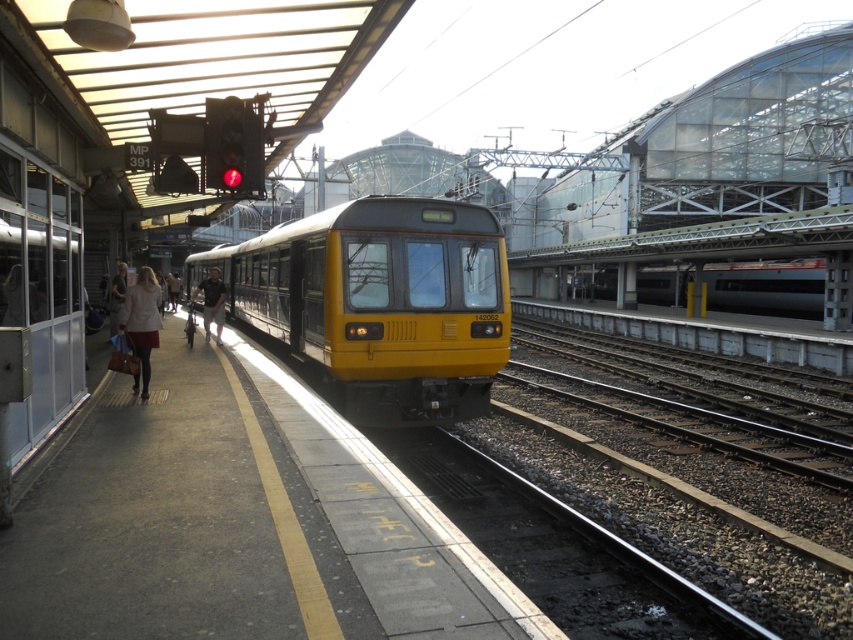
You are a photographer standing on the platform and want to capture both the yellow matte train at center and the matte beige jacket at left in the same frame. Considering their sizes, which object should you focus on to ensure both are clearly visible in the photo?

The yellow matte train at center is larger in size than the matte beige jacket at left, so focusing on the yellow matte train at center would ensure both are clearly visible in the photo.

You are standing on the platform and want to take a photo of the yellow matte train at center. If your camera can focus on objects up to 10 meters away, will it be able to capture the train clearly?

The yellow matte train at center is 8.97 meters away from the camera, which is within the camera focus range of up to 10 meters. Therefore, the camera can capture the train clearly.

You are a passenger waiting at the train station platform. You notice a person wearing a matte beige jacket at left and dark gray pants at left. Which clothing item takes up more space on the person?

The dark gray pants at left occupies more space than the matte beige jacket at left.